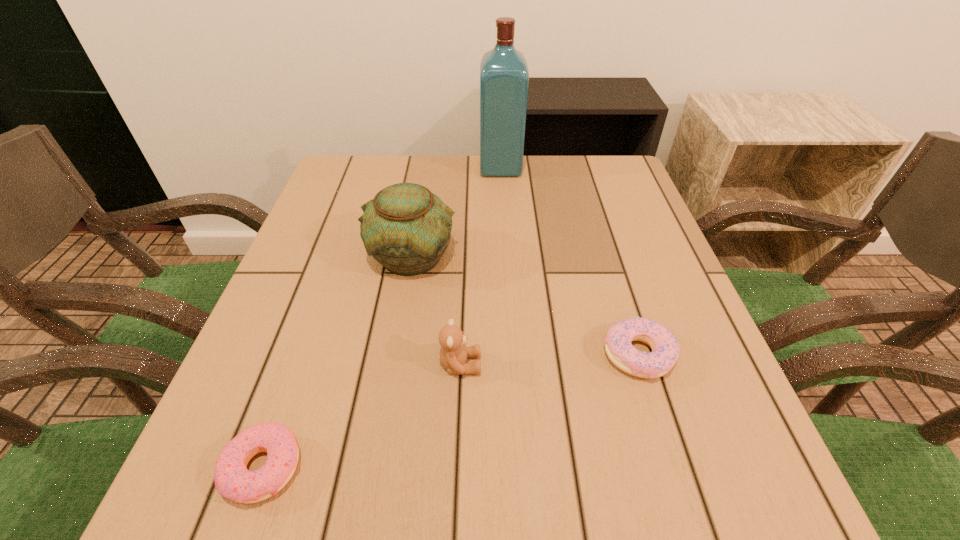
Locate an element on the screen. The width and height of the screenshot is (960, 540). object that is at the right edge is located at coordinates (665, 349).

Image resolution: width=960 pixels, height=540 pixels. I want to click on object present at the near left corner, so click(x=232, y=479).

Find the location of `vacant region at the far edge of the desktop`. vacant region at the far edge of the desktop is located at coordinates (484, 184).

This screenshot has height=540, width=960. In order to click on vacant space at the near edge of the desktop in this screenshot , I will do `click(449, 457)`.

The image size is (960, 540). I want to click on free space at the left edge of the desktop, so click(x=309, y=268).

In the image, there is a desktop. Where is `free region at the right edge`? free region at the right edge is located at coordinates (666, 252).

You are a GUI agent. You are given a task and a screenshot of the screen. Output one action in this format:
    pyautogui.click(x=<x>, y=<y>)
    Task: Click on the free location at the far left corner
    
    Given the screenshot: What is the action you would take?
    pyautogui.click(x=390, y=158)

Identify the location of free space at the far right corner. (600, 171).

Find the location of `vacant area that lies between the farther doughnut and the farthest object`. vacant area that lies between the farther doughnut and the farthest object is located at coordinates (569, 261).

Where is `free spot between the farther doughnut and the second tallest object`? This screenshot has width=960, height=540. free spot between the farther doughnut and the second tallest object is located at coordinates (525, 305).